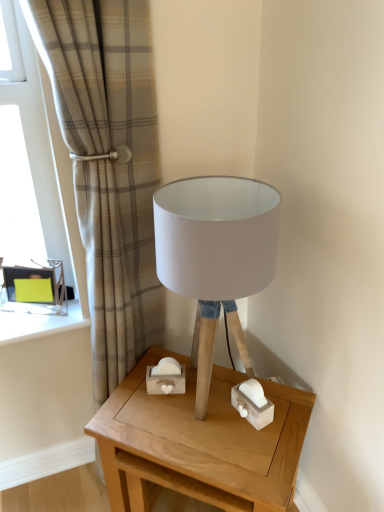
Find the location of a particular element. The width and height of the screenshot is (384, 512). free spot above wooden table at center (from a real-world perspective) is located at coordinates (204, 416).